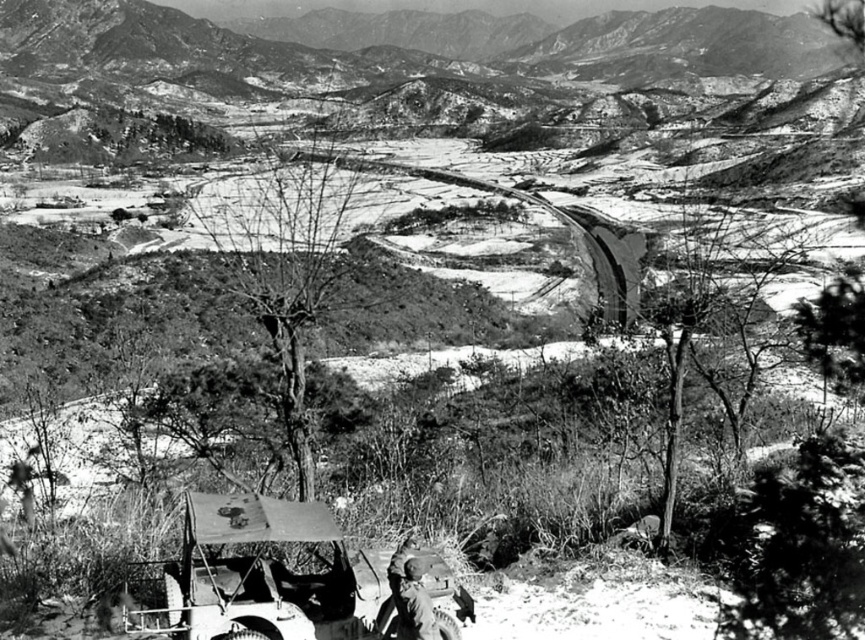
Question: Does metallic matte jeep at lower left have a lesser width compared to camouflage fabric uniform at lower center?

Choices:
 (A) no
 (B) yes

Answer: (A)

Question: Is metallic matte jeep at lower left thinner than camouflage fabric uniform at lower center?

Choices:
 (A) no
 (B) yes

Answer: (A)

Question: Which point appears farthest from the camera in this image?

Choices:
 (A) (411, 545)
 (B) (381, 621)

Answer: (A)

Question: Is metallic matte jeep at lower left behind camouflage fabric uniform at lower center?

Choices:
 (A) no
 (B) yes

Answer: (A)